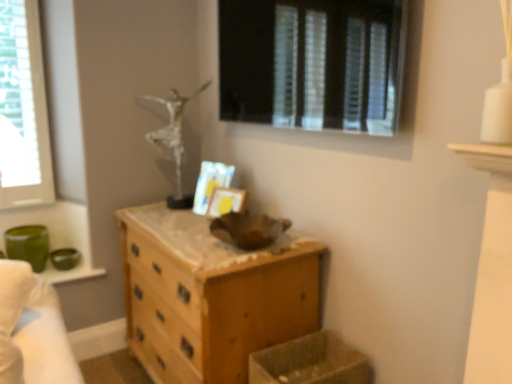
Question: Can you confirm if clear glass window at left, which appears as the 2th window when viewed from the front, is positioned to the left of transparent glass window at upper center, the second window in the back-to-front sequence?

Choices:
 (A) no
 (B) yes

Answer: (B)

Question: From the image's perspective, would you say clear glass window at left, which appears as the 2th window when viewed from the front, is positioned over transparent glass window at upper center, placed as the 2th window when sorted from left to right?

Choices:
 (A) yes
 (B) no

Answer: (B)

Question: Is clear glass window at left, positioned as the 1th window in back-to-front order, completely or partially outside of transparent glass window at upper center, placed as the 2th window when sorted from left to right?

Choices:
 (A) no
 (B) yes

Answer: (B)

Question: Does clear glass window at left, the first window when ordered from left to right, have a greater width compared to transparent glass window at upper center, placed as the 1th window when sorted from front to back?

Choices:
 (A) yes
 (B) no

Answer: (B)

Question: Is clear glass window at left, which appears as the second window when viewed from the right, turned away from transparent glass window at upper center, placed as the 1th window when sorted from front to back?

Choices:
 (A) yes
 (B) no

Answer: (B)

Question: From a real-world perspective, is green fabric bed at left positioned above or below wooden chest of drawers at center?

Choices:
 (A) above
 (B) below

Answer: (A)

Question: From the image's perspective, relative to wooden chest of drawers at center, is green fabric bed at left above or below?

Choices:
 (A) below
 (B) above

Answer: (B)

Question: Relative to wooden chest of drawers at center, is green fabric bed at left in front or behind?

Choices:
 (A) front
 (B) behind

Answer: (A)

Question: In the image, is green fabric bed at left on the left side or the right side of wooden chest of drawers at center?

Choices:
 (A) right
 (B) left

Answer: (B)

Question: Is point (287, 286) positioned closer to the camera than point (57, 339)?

Choices:
 (A) farther
 (B) closer

Answer: (A)

Question: Is wooden chest of drawers at center in front of or behind green fabric bed at left in the image?

Choices:
 (A) behind
 (B) front

Answer: (A)

Question: In the image, is wooden chest of drawers at center on the left side or the right side of green fabric bed at left?

Choices:
 (A) left
 (B) right

Answer: (B)

Question: In terms of height, does wooden chest of drawers at center look taller or shorter compared to green fabric bed at left?

Choices:
 (A) short
 (B) tall

Answer: (B)

Question: Based on their sizes in the image, would you say transparent glass window at upper center, the 1th window when ordered from right to left, is bigger or smaller than translucent plastic crate at lower center?

Choices:
 (A) big
 (B) small

Answer: (A)

Question: From the image's perspective, is transparent glass window at upper center, the 1th window when ordered from right to left, located above or below translucent plastic crate at lower center?

Choices:
 (A) below
 (B) above

Answer: (B)